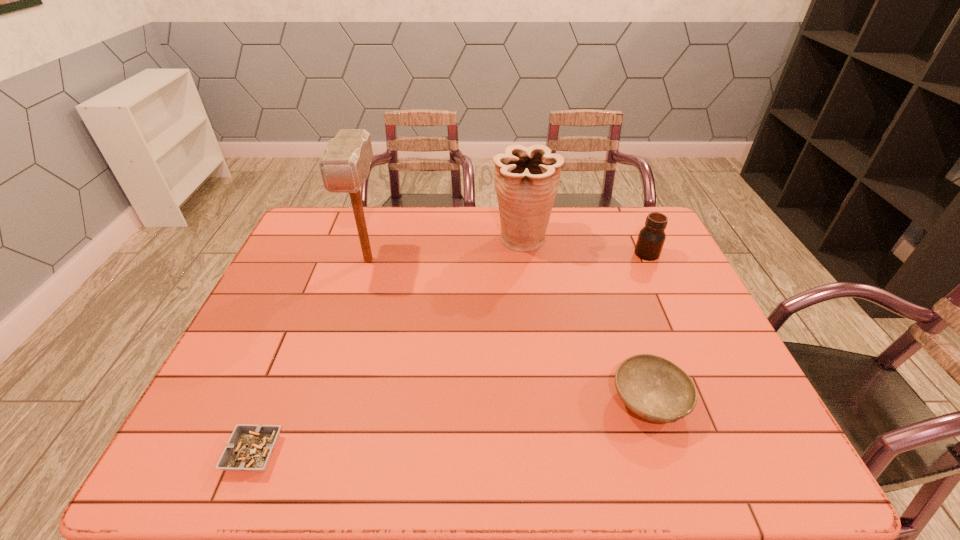
Find the location of `free space that is in between the mallet and the ashtray`. free space that is in between the mallet and the ashtray is located at coordinates (311, 356).

This screenshot has width=960, height=540. What are the coordinates of `free space between the third tallest object and the second object from right to left` in the screenshot? It's located at (648, 327).

In order to click on free space between the leftmost object and the mallet in this screenshot , I will do `click(311, 356)`.

At what (x,y) coordinates should I click in order to perform the action: click on vacant point located between the bowl and the third object from right to left. Please return your answer as a coordinate pair (x, y). Looking at the image, I should click on (586, 321).

Identify which object is located as the third nearest to the jar. Please provide its 2D coordinates. Your answer should be formatted as a tuple, i.e. [(x, y)], where the tuple contains the x and y coordinates of a point satisfying the conditions above.

[(345, 165)]

I want to click on the fourth closest object to the shortest object, so click(651, 238).

This screenshot has width=960, height=540. In order to click on free spot that satisfies the following two spatial constraints: 1. on the back side of the shortest object; 2. on the right side of the bowl in this screenshot , I will do `click(275, 401)`.

This screenshot has width=960, height=540. What are the coordinates of `vacant space that satisfies the following two spatial constraints: 1. on the back side of the shortest object; 2. on the right side of the fourth shortest object` in the screenshot? It's located at (340, 240).